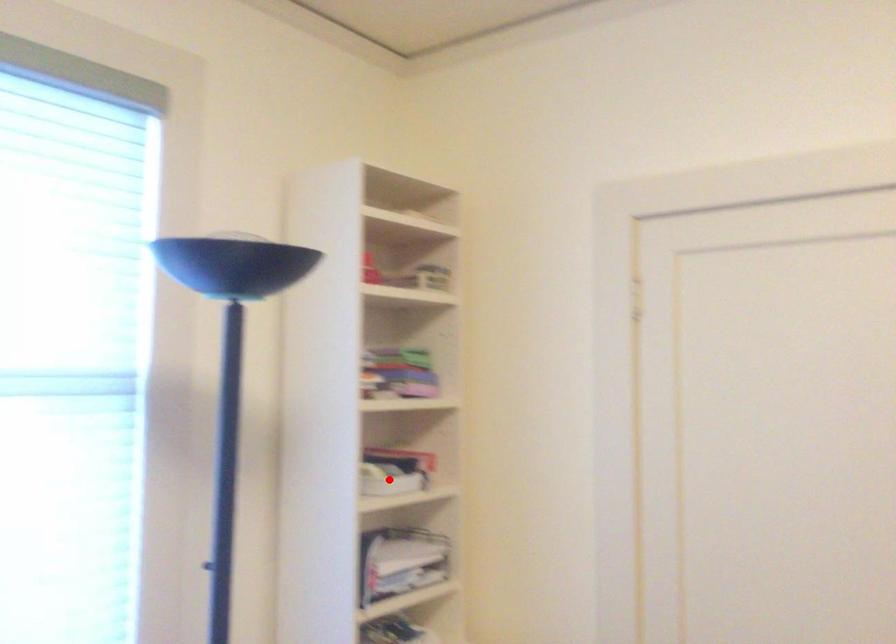
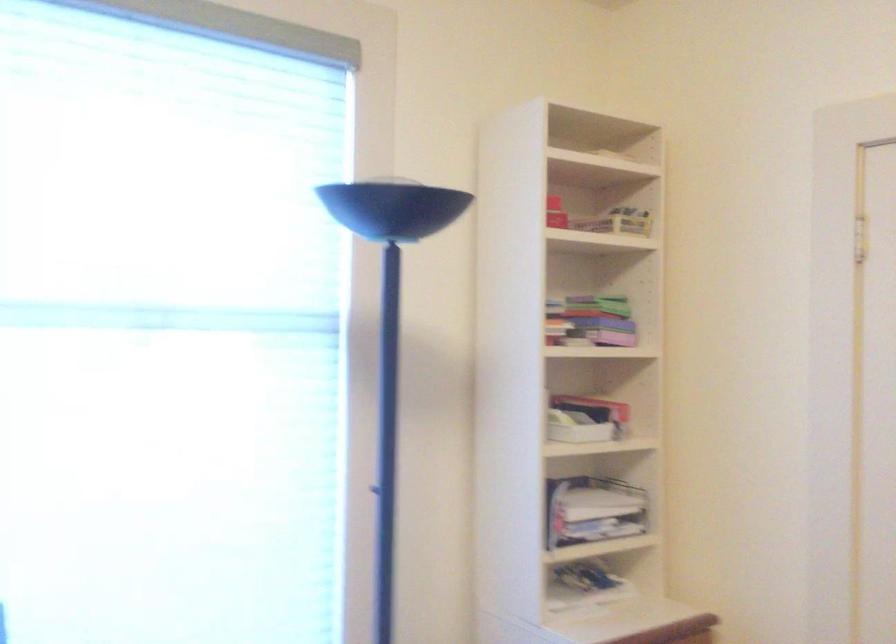
Where in the second image is the point corresponding to the highlighted location from the first image?

(576, 428)